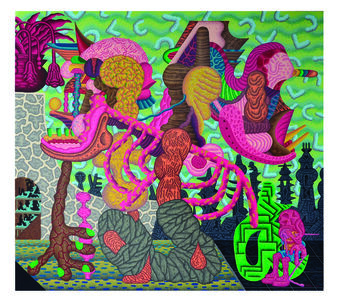
Find the location of a particular element. chess piece is located at coordinates (308, 185).